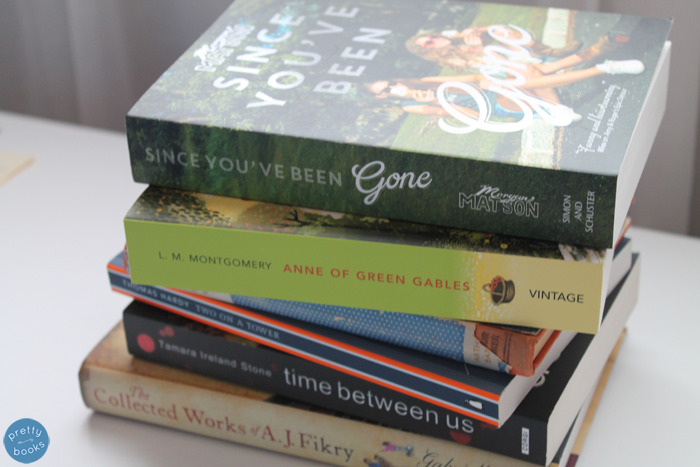
What are the coordinates of `book` in the screenshot? It's located at (278, 435), (267, 376), (285, 342), (376, 323), (382, 278), (385, 191).